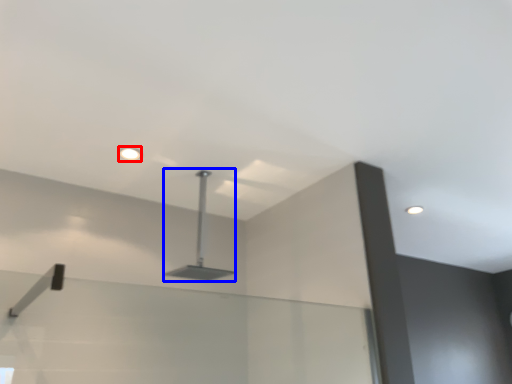
Question: Which object appears closest to the camera in this image, droplight (highlighted by a red box) or lamp (highlighted by a blue box)?

Choices:
 (A) droplight
 (B) lamp

Answer: (B)